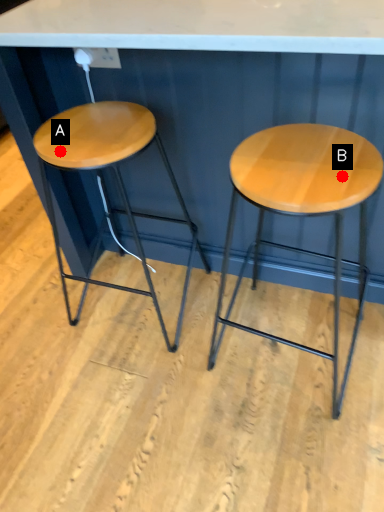
Question: Two points are circled on the image, labeled by A and B beside each circle. Which point appears closest to the camera in this image?

Choices:
 (A) A is closer
 (B) B is closer

Answer: (B)